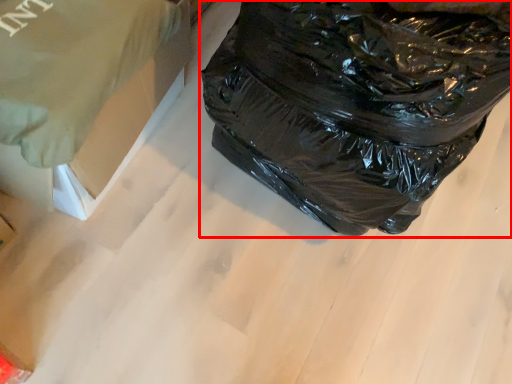
Question: From the image's perspective, where is plastic bag (annotated by the red box) located relative to cardboard box?

Choices:
 (A) above
 (B) below

Answer: (A)